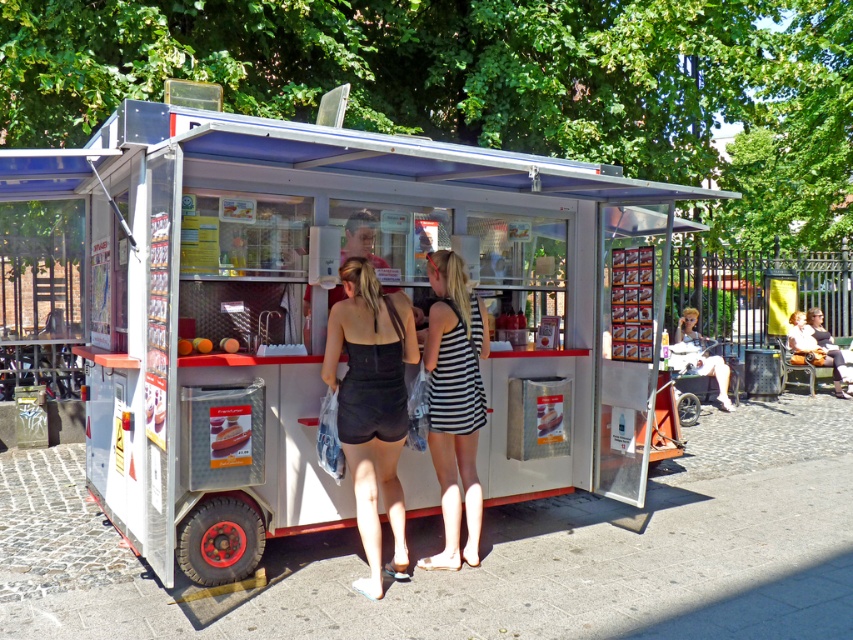
Question: Among these points, which one is farthest from the camera?

Choices:
 (A) (677, 326)
 (B) (209, 497)

Answer: (A)

Question: Where is white metallic food truck at center located in relation to black matte dress at center in the image?

Choices:
 (A) above
 (B) below

Answer: (A)

Question: Can you confirm if black matte dress at center is smaller than light beige fabric at right?

Choices:
 (A) yes
 (B) no

Answer: (B)

Question: Estimate the real-world distances between objects in this image. Which object is closer to the black matte dress at center?

Choices:
 (A) white metallic food truck at center
 (B) light beige fabric at right

Answer: (A)

Question: Considering the relative positions of striped fabric dress at center and light brown leather jacket at right in the image provided, where is striped fabric dress at center located with respect to light brown leather jacket at right?

Choices:
 (A) below
 (B) above

Answer: (A)

Question: Which point appears closest to the camera in this image?

Choices:
 (A) (840, 355)
 (B) (392, 561)
 (C) (457, 336)
 (D) (358, 211)

Answer: (C)